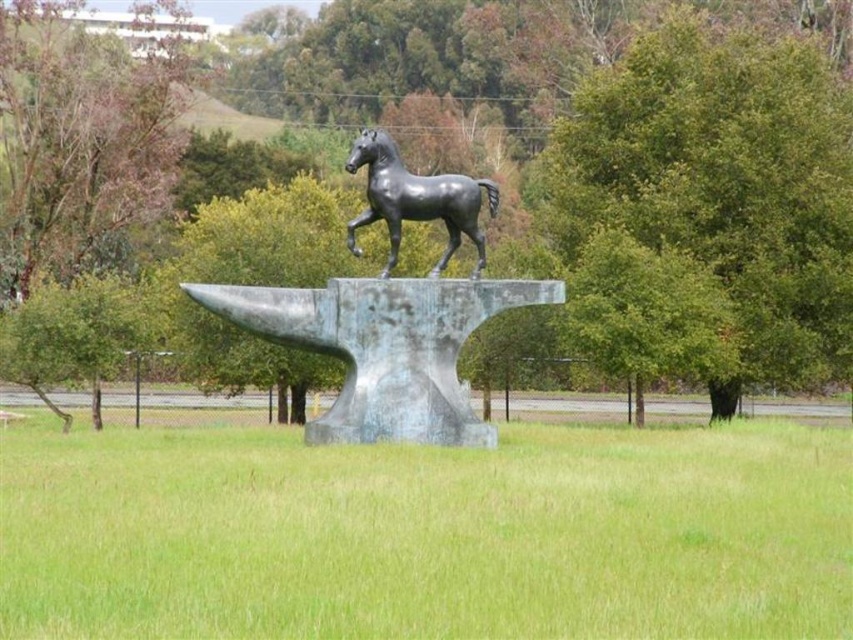
Question: Which point is farther to the camera?

Choices:
 (A) bronze horse at center
 (B) polished bronze horse at center

Answer: (B)

Question: Considering the real-world distances, which object is farthest from the green grass at center?

Choices:
 (A) bronze horse at center
 (B) polished bronze horse at center

Answer: (B)

Question: Where is bronze horse at center located in relation to polished bronze horse at center in the image?

Choices:
 (A) below
 (B) above

Answer: (A)

Question: Which point appears closest to the camera in this image?

Choices:
 (A) (612, 618)
 (B) (372, 157)

Answer: (A)

Question: Considering the relative positions of bronze horse at center and polished bronze horse at center in the image provided, where is bronze horse at center located with respect to polished bronze horse at center?

Choices:
 (A) right
 (B) left

Answer: (B)

Question: Can you confirm if green grass at center is thinner than bronze horse at center?

Choices:
 (A) no
 (B) yes

Answer: (A)